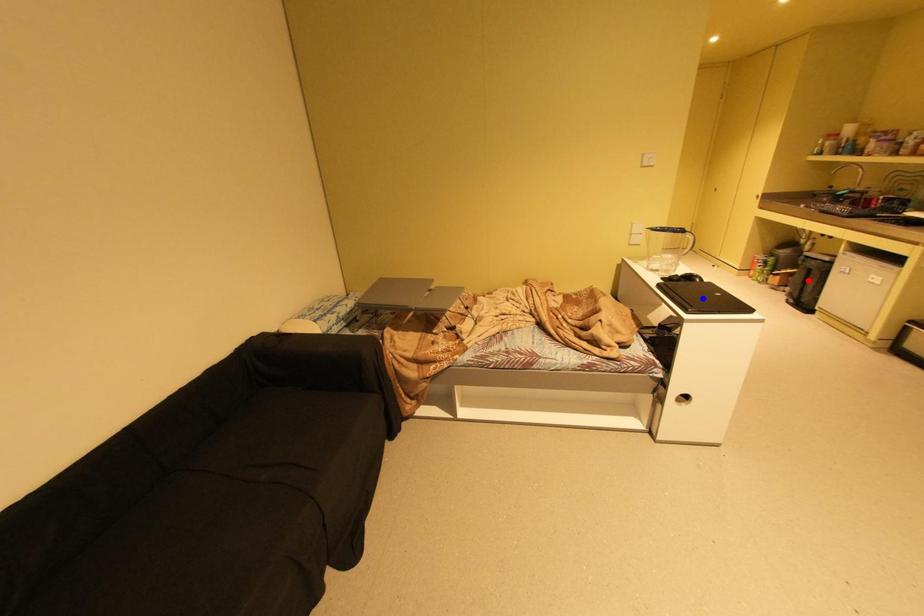
Question: Which of the two points in the image is closer to the camera?

Choices:
 (A) Blue point is closer.
 (B) Red point is closer.

Answer: (A)